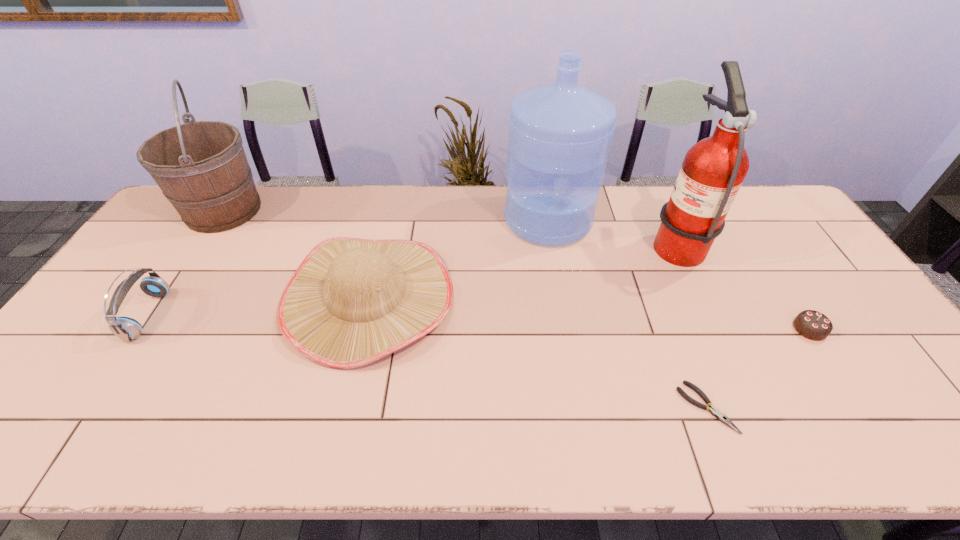
The width and height of the screenshot is (960, 540). I want to click on fire extinguisher situated at the far edge, so click(713, 170).

Where is `bucket that is at the far edge`? bucket that is at the far edge is located at coordinates (201, 167).

Identify the location of object present at the near edge. (719, 415).

This screenshot has width=960, height=540. Find the location of `bucket that is positioned at the left edge`. bucket that is positioned at the left edge is located at coordinates (201, 167).

Find the location of a particular element. This screenshot has height=540, width=960. headset that is at the left edge is located at coordinates (127, 329).

At what (x,y) coordinates should I click in order to perform the action: click on object present at the right edge. Please return your answer as a coordinate pair (x, y). The image size is (960, 540). Looking at the image, I should click on (813, 325).

Identify the location of object that is at the far left corner. (201, 167).

This screenshot has height=540, width=960. Identify the location of free point at the far edge. (387, 218).

Where is `free space at the near edge of the desktop`? This screenshot has width=960, height=540. free space at the near edge of the desktop is located at coordinates (402, 422).

Where is `vacant area at the left edge of the desktop`? The width and height of the screenshot is (960, 540). vacant area at the left edge of the desktop is located at coordinates (74, 354).